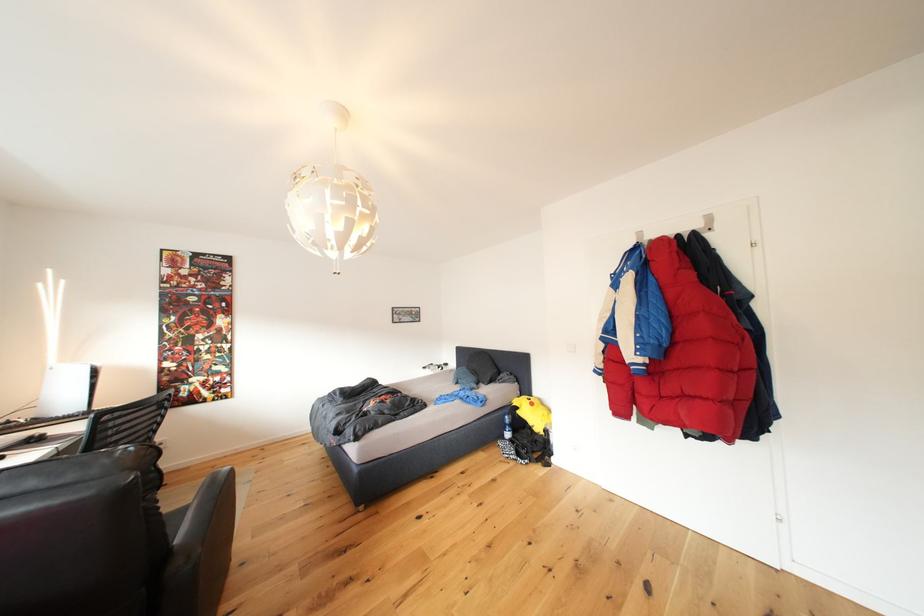
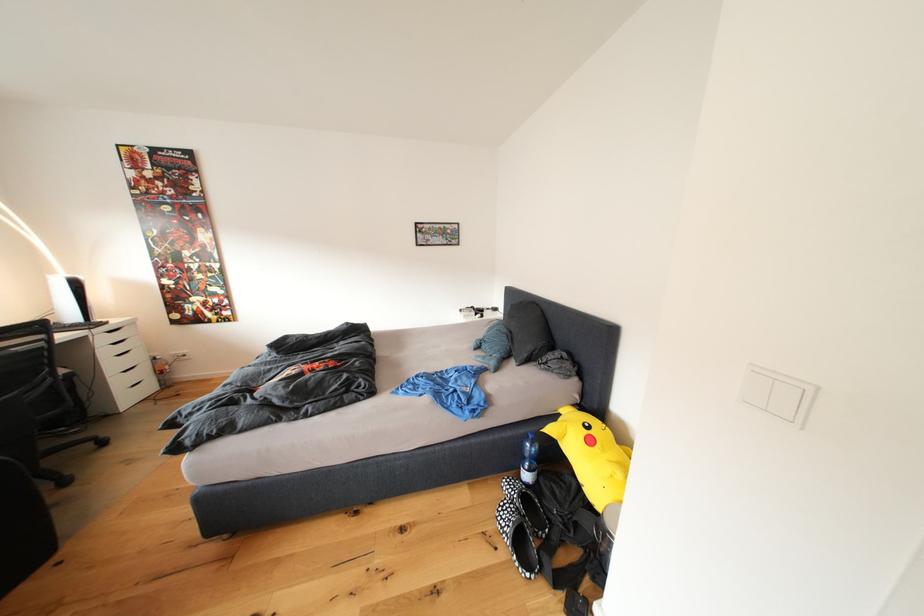
Locate, in the second image, the point that corresponds to (x=433, y=373) in the first image.

(469, 315)